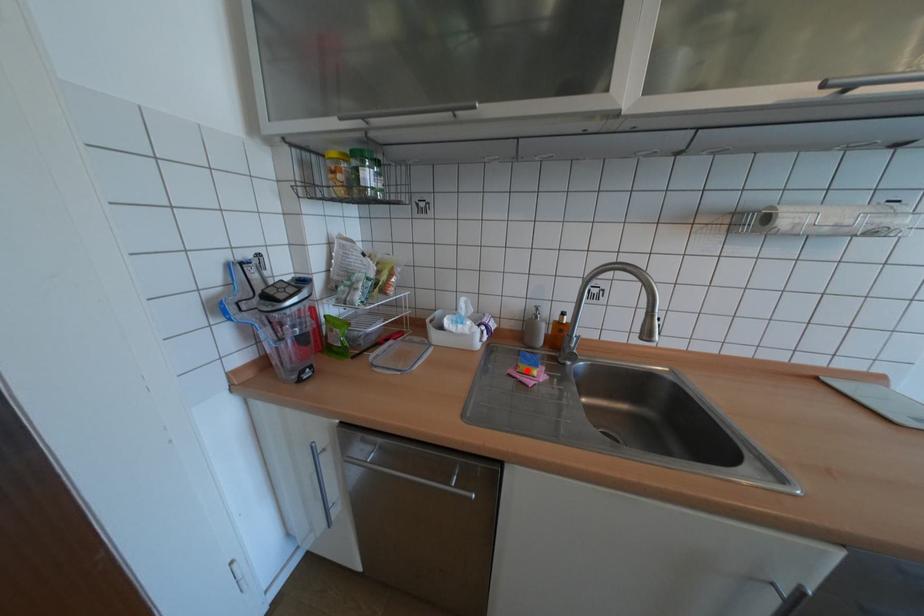
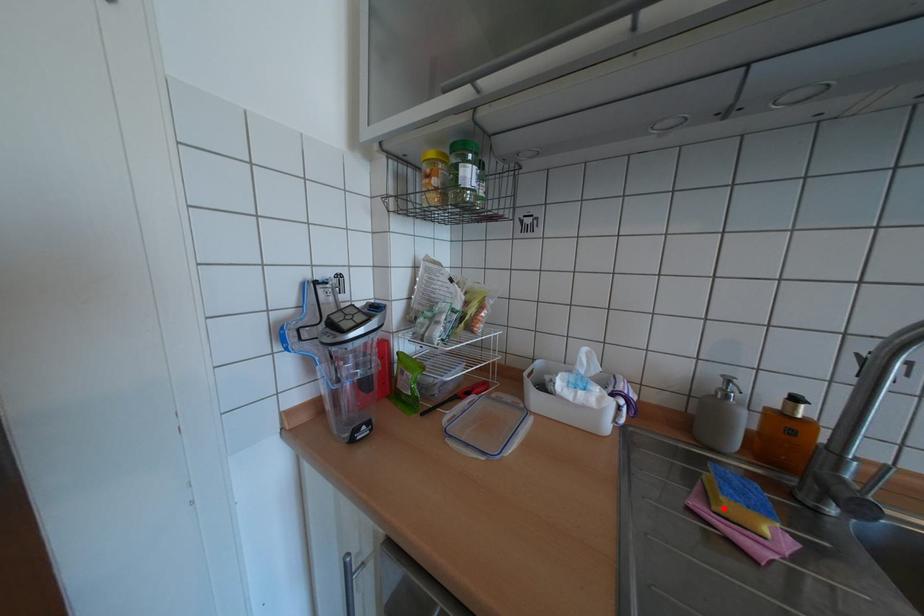
I am providing you with two images of the same scene from different viewpoints. A red point is marked on the first image and another point is marked on the second image. Are the points marked in image1 and image2 representing the same 3D position?

Yes